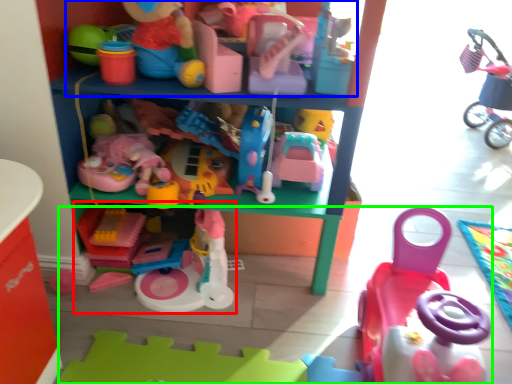
Question: Considering the real-world distances, which object is closest to toy (highlighted by a red box)? toy (highlighted by a blue box) or toy (highlighted by a green box).

Choices:
 (A) toy
 (B) toy

Answer: (B)